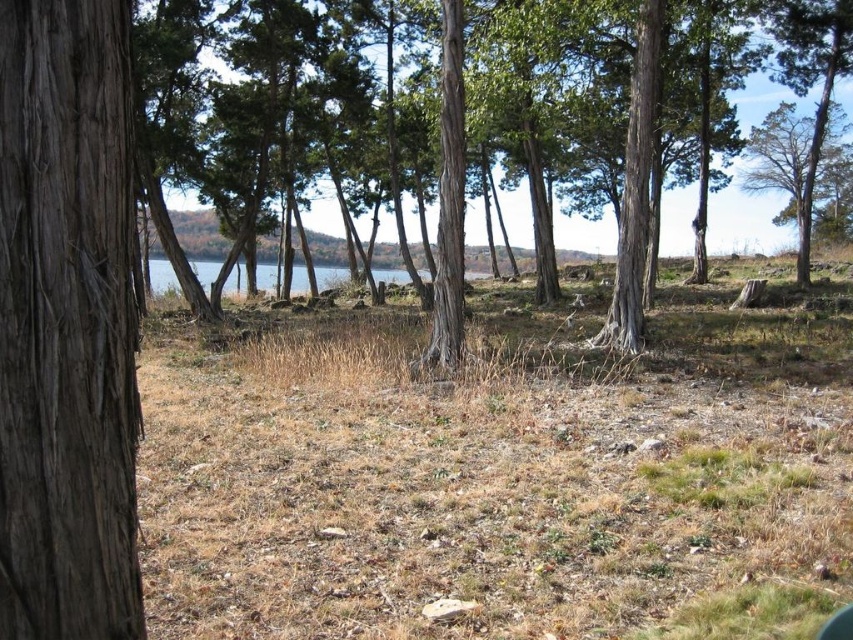
You are standing at the point labeled point [115,541] and want to walk to the point labeled point [447,54]. Given that you can only move in a straight line, will you be moving towards the background or the foreground of the image?

Since point [115,541] is closer to the viewer than point [447,54], moving from the former to the latter would mean moving towards the background of the image.

You are planning to set up a small tent between the brown rough bark tree at left and the green rough bark tree at center. The tent requires at least 8 meters of space between the two trees to be properly pitched. Based on the scene description, will there be enough space for the tent?

The brown rough bark tree at left and green rough bark tree at center are 8.36 meters apart, which is more than the required 8 meters. Therefore, there is sufficient space to set up the tent between them.

You are an environmental scientist analyzing tree growth patterns in this area. You observe the brown rough bark tree at left and the green rough bark tree at center. Which tree would you estimate has a smaller physical footprint in this environment?

The brown rough bark tree at left occupies less space than the green rough bark tree at center, so it has a smaller physical footprint.